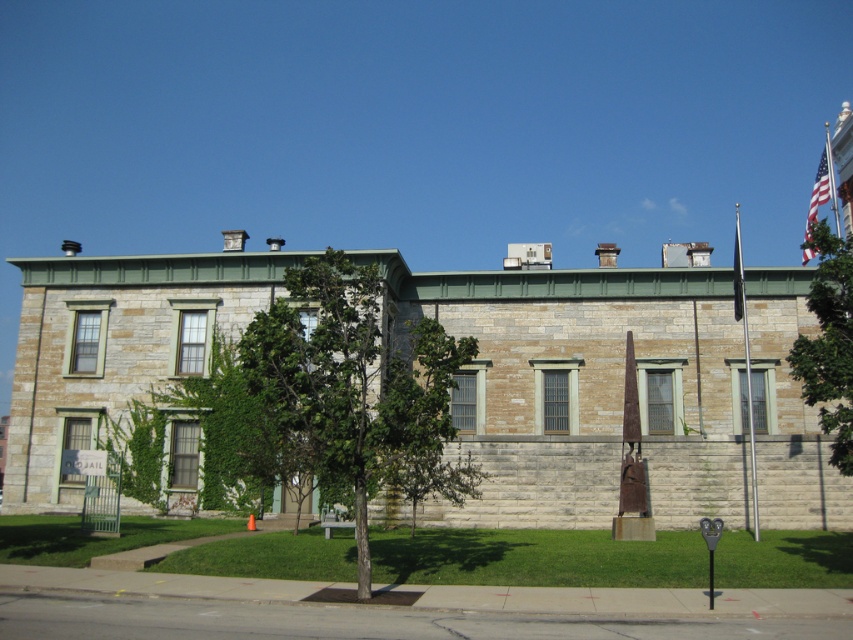
Question: Can you confirm if green leafy tree at center is thinner than green leafy tree at upper right?

Choices:
 (A) no
 (B) yes

Answer: (B)

Question: Which object is farther from the camera taking this photo?

Choices:
 (A) polished metal flag pole at right
 (B) green leafy tree at upper right
 (C) green leafy tree at center

Answer: (A)

Question: Which point is closer to the camera?

Choices:
 (A) (831, 170)
 (B) (851, 310)
 (C) (337, 403)

Answer: (C)

Question: Which point appears closest to the camera in this image?

Choices:
 (A) [834, 205]
 (B) [810, 241]
 (C) [366, 524]
 (D) [834, 285]

Answer: (B)

Question: Can you confirm if green leafy tree at center is bigger than american flag at upper right?

Choices:
 (A) no
 (B) yes

Answer: (A)

Question: Does green leafy tree at center appear under american flag at upper right?

Choices:
 (A) yes
 (B) no

Answer: (A)